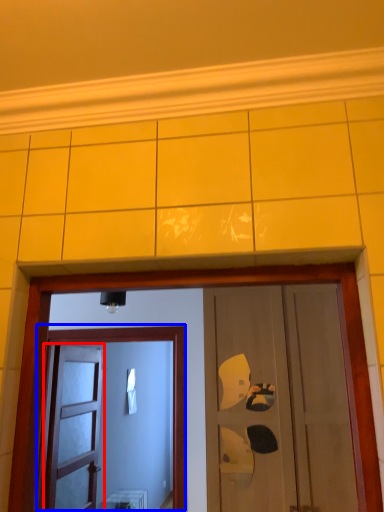
Question: Which object appears farthest to the camera in this image, door (highlighted by a red box) or door (highlighted by a blue box)?

Choices:
 (A) door
 (B) door

Answer: (A)